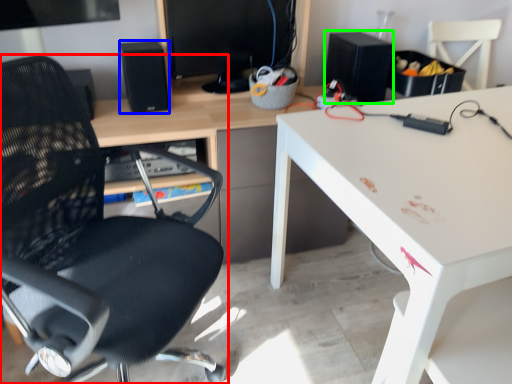
Question: Estimate the real-world distances between objects in this image. Which object is farther from chair (highlighted by a red box), speaker (highlighted by a blue box) or speaker (highlighted by a green box)?

Choices:
 (A) speaker
 (B) speaker

Answer: (B)